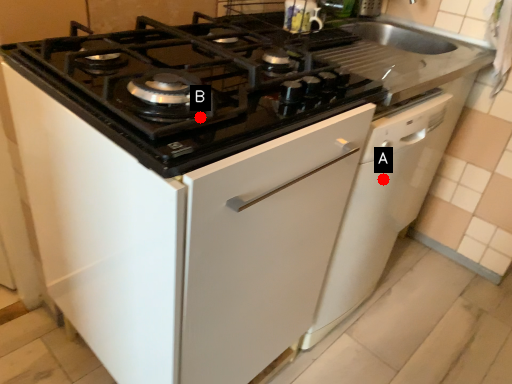
Question: Two points are circled on the image, labeled by A and B beside each circle. Which point is farther from the camera taking this photo?

Choices:
 (A) A is further
 (B) B is further

Answer: (A)